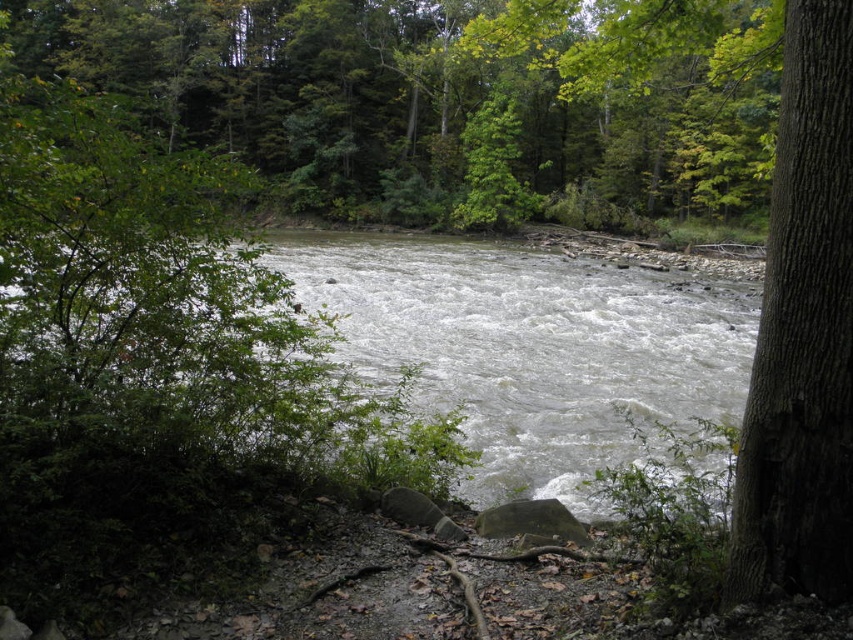
Is green leafy tree at center closer to the viewer compared to white frothy water at center?

That is True.

Is green leafy tree at center positioned at the back of white frothy water at center?

No, it is in front of white frothy water at center.

Which is in front, point (426, 104) or point (514, 300)?

Positioned in front is point (514, 300).

Where is `green leafy tree at center`? This screenshot has width=853, height=640. green leafy tree at center is located at coordinates (436, 100).

Does white frothy water at center appear over smooth brown tree trunk at right?

Correct, white frothy water at center is located above smooth brown tree trunk at right.

Which is more to the left, white frothy water at center or smooth brown tree trunk at right?

From the viewer's perspective, smooth brown tree trunk at right appears more on the left side.

Is point (517, 358) less distant than point (842, 120)?

No, it is behind (842, 120).

This screenshot has height=640, width=853. Find the location of `white frothy water at center`. white frothy water at center is located at coordinates (529, 348).

Is green leafy tree at center positioned at the back of smooth brown tree trunk at right?

That is True.

Is green leafy tree at center taller than smooth brown tree trunk at right?

Indeed, green leafy tree at center has a greater height compared to smooth brown tree trunk at right.

Locate an element on the screen. The height and width of the screenshot is (640, 853). green leafy tree at center is located at coordinates (436, 100).